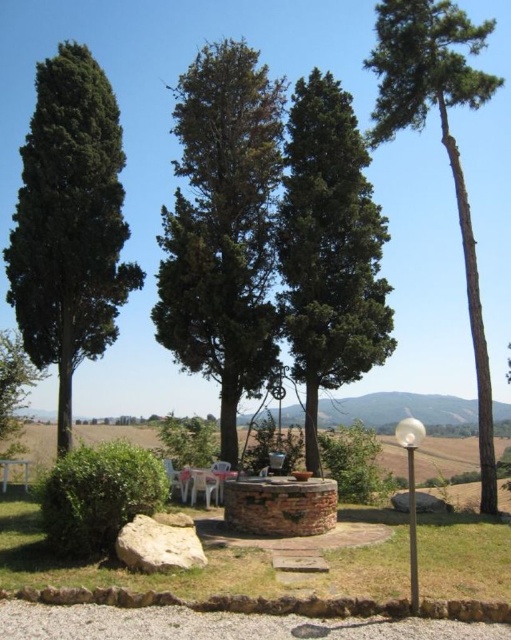
Question: Which of these objects is positioned closest to the green leafy tree at center?

Choices:
 (A) green rough bark tree at right
 (B) white plastic picnic table at lower left
 (C) white plastic chair at lower center
 (D) white plastic picnic table at center

Answer: (A)

Question: Considering the real-world distances, which object is farthest from the green matte tree at center?

Choices:
 (A) white plastic picnic table at lower left
 (B) white plastic chair at center

Answer: (A)

Question: Does green leafy tree at center come behind white plastic chair at lower center?

Choices:
 (A) yes
 (B) no

Answer: (A)

Question: Is green leafy tree at center behind green leafy tree at lower left?

Choices:
 (A) no
 (B) yes

Answer: (B)

Question: Which object appears closest to the camera in this image?

Choices:
 (A) white plastic chair at center
 (B) white plastic picnic table at lower left

Answer: (A)

Question: Does white plastic picnic table at lower left lie in front of white plastic chair at center?

Choices:
 (A) yes
 (B) no

Answer: (B)